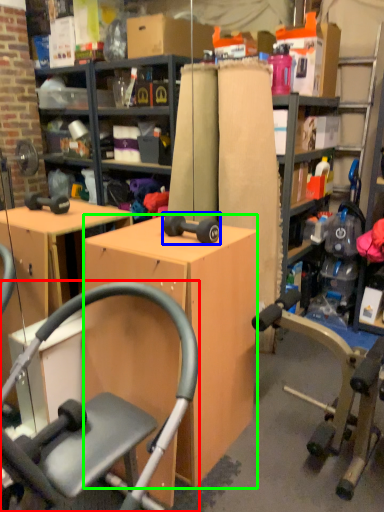
Question: Which object is positioned closest to chair (highlighted by a red box)? Select from dumbbell (highlighted by a blue box) and desk (highlighted by a green box).

Choices:
 (A) dumbbell
 (B) desk

Answer: (B)